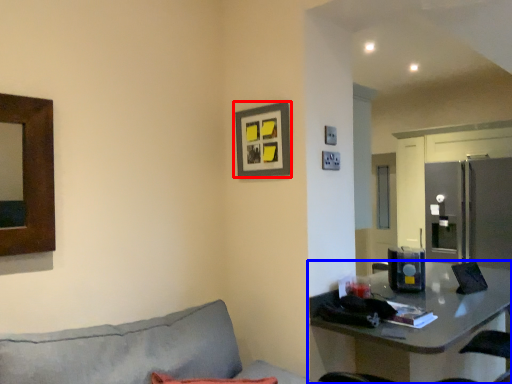
Question: Which object is further to the camera taking this photo, picture frame (highlighted by a red box) or table (highlighted by a blue box)?

Choices:
 (A) picture frame
 (B) table

Answer: (A)